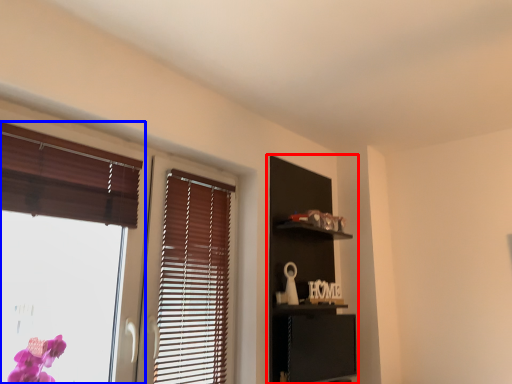
Question: Which object is closer to the camera taking this photo, dresser (highlighted by a red box) or window (highlighted by a blue box)?

Choices:
 (A) dresser
 (B) window

Answer: (B)